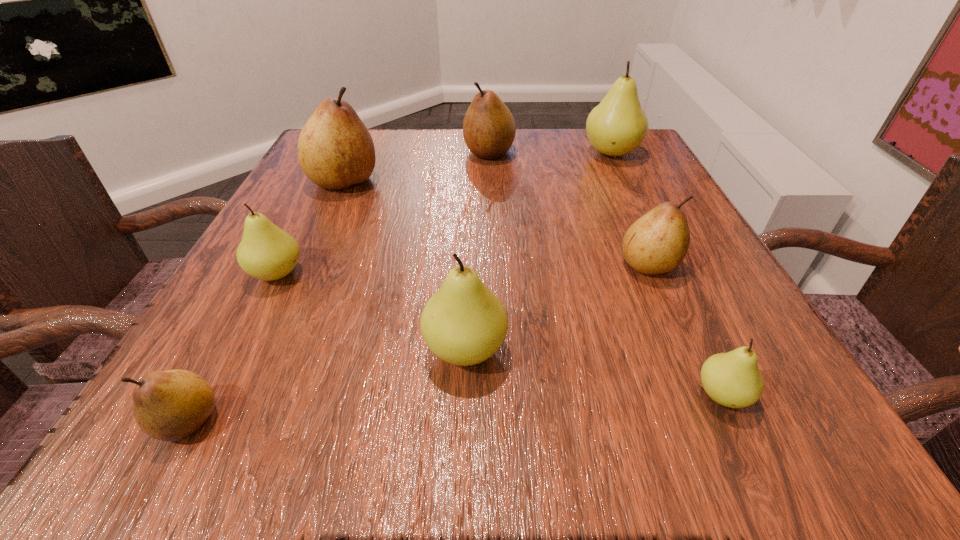
Locate an element on the screen. This screenshot has height=540, width=960. free space between the second brown pear from right to left and the biggest green pear is located at coordinates (550, 153).

Image resolution: width=960 pixels, height=540 pixels. In order to click on free space between the third smallest brown pear and the second biggest green pear in this screenshot , I will do `click(477, 251)`.

What are the coordinates of `free space between the third smallest brown pear and the second biggest green pear` in the screenshot? It's located at (477, 251).

I want to click on free space between the second green pear from left to right and the smallest green pear, so click(x=593, y=372).

Where is `free space between the biggest brown pear and the smallest brown pear`? The width and height of the screenshot is (960, 540). free space between the biggest brown pear and the smallest brown pear is located at coordinates (266, 301).

You are a GUI agent. You are given a task and a screenshot of the screen. Output one action in this format:
    pyautogui.click(x=<x>, y=<y>)
    Task: Click on the vacant space in between the smallest green pear and the smallest brown pear
    
    Given the screenshot: What is the action you would take?
    pyautogui.click(x=455, y=408)

Locate an element on the screen. The width and height of the screenshot is (960, 540). object that is the fifth closest to the second farthest green pear is located at coordinates (656, 243).

Locate an element on the screen. The image size is (960, 540). object that is the fifth closest one to the farthest green pear is located at coordinates (733, 379).

Identify the location of pear identified as the fifth closest to the smallest green pear. (170, 405).

Locate which pear is the fifth closest to the third smallest green pear. Please provide its 2D coordinates. Your answer should be formatted as a tuple, i.e. [(x, y)], where the tuple contains the x and y coordinates of a point satisfying the conditions above.

[(335, 150)]